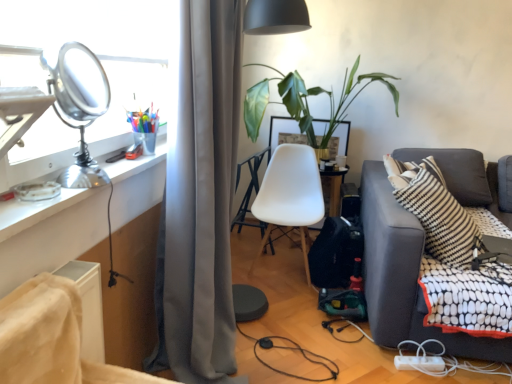
Question: Is velvet-like beige chair at lower left, arranged as the first chair when viewed from the front, taller or shorter than metallic silver desk at left?

Choices:
 (A) tall
 (B) short

Answer: (A)

Question: From the image's perspective, is velvet-like beige chair at lower left, arranged as the first chair when viewed from the front, located above or below metallic silver desk at left?

Choices:
 (A) above
 (B) below

Answer: (B)

Question: Which is farther from the white plastic chair at center, which appears as the second chair when viewed from the left?

Choices:
 (A) shiny metallic table lamp at upper left
 (B) metallic silver desk at left
 (C) white plastic table at center
 (D) dark gray fabric couch at right
 (E) white plastic power strip at lower right

Answer: (A)

Question: Based on their relative distances, which object is nearer to the white plastic chair at center, which is the 1th chair in right-to-left order?

Choices:
 (A) metallic silver desk at left
 (B) velvet-like beige chair at lower left, marked as the second chair in a right-to-left arrangement
 (C) white plastic table at center
 (D) shiny metallic table lamp at upper left
 (E) green leafy plant at center

Answer: (C)